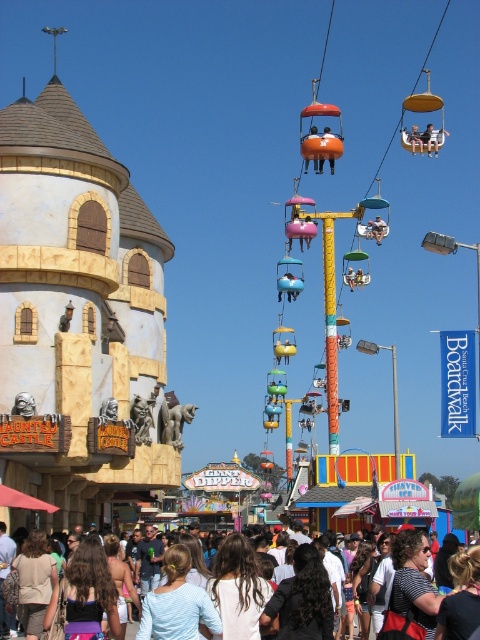
Which of these two, beige stone tower at left or orange plastic gondola at center, stands taller?

With more height is orange plastic gondola at center.

Is point (164, 461) positioned before point (330, 19)?

Yes, point (164, 461) is in front of point (330, 19).

Find the location of a particular element. The image size is (480, 640). beige stone tower at left is located at coordinates (78, 320).

Does beige stone tower at left appear on the right side of matte black hair at center?

Incorrect, beige stone tower at left is not on the right side of matte black hair at center.

Is beige stone tower at left positioned at the back of matte black hair at center?

Yes, it is.

Image resolution: width=480 pixels, height=640 pixels. In order to click on beige stone tower at left in this screenshot , I will do `click(78, 320)`.

Is matte black hair at center thinner than orange plastic gondola at center?

No.

Can you confirm if matte black hair at center is positioned below orange plastic gondola at center?

Yes.

Image resolution: width=480 pixels, height=640 pixels. What do you see at coordinates (119, 568) in the screenshot?
I see `matte black hair at center` at bounding box center [119, 568].

I want to click on matte black hair at center, so click(119, 568).